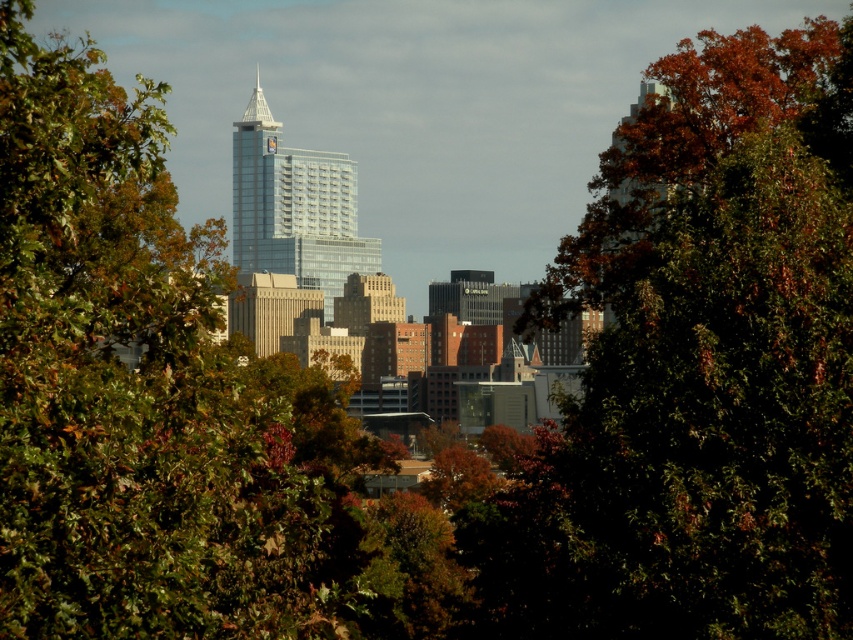
You are standing in a park and looking at the city through a gap in the trees. You notice a point marked at coordinates (711, 356). What is located at that point?

The point at coordinates (711, 356) corresponds to autumn leaves at center.

You are an urban planner analyzing a city park. You observe the autumn leaves at center and the green leafy tree at center in the scene. Which object takes up more horizontal space in the image?

The green leafy tree at center takes up more horizontal space than the autumn leaves at center because the autumn leaves at center has a lesser width compared to green leafy tree at center.

You are standing in a park and looking at the cityscape through the trees. There are two points marked in the image. The first point is at coordinates point (547, 292) and the second is at point (199, 362). Which point is closer to you?

Point (547, 292) is further to the viewer than point (199, 362), so the second point is closer to you.